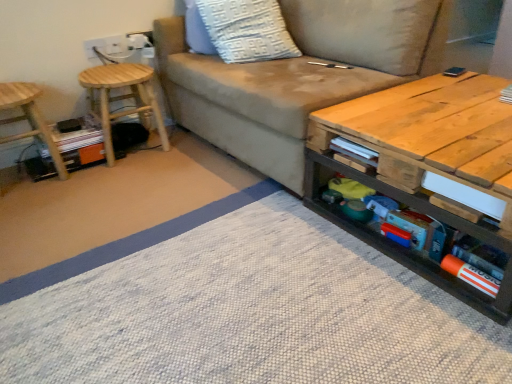
Image resolution: width=512 pixels, height=384 pixels. Find the location of `vacant space situated on the left part of white paper book at right, placed as the 1th book when sorted from back to front`. vacant space situated on the left part of white paper book at right, placed as the 1th book when sorted from back to front is located at coordinates (475, 97).